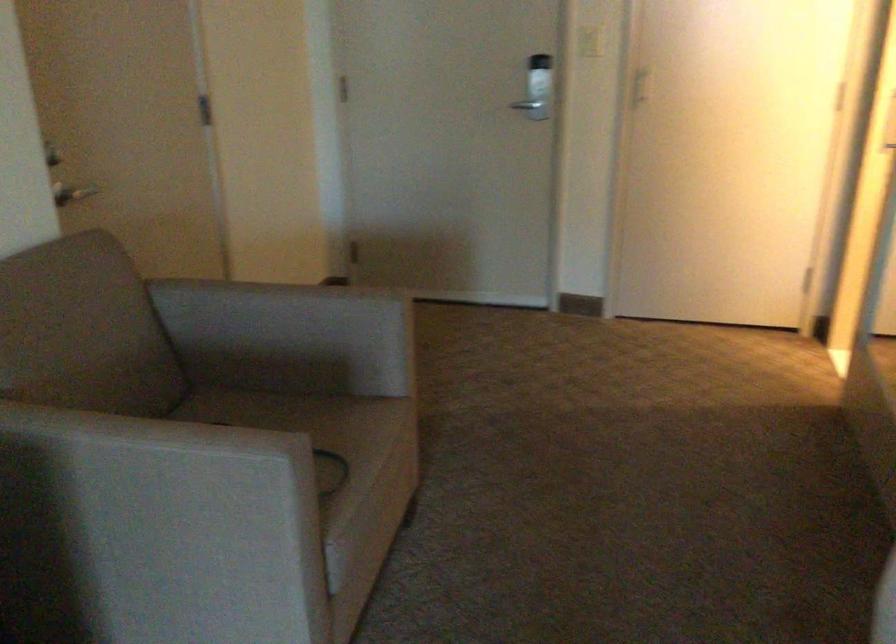
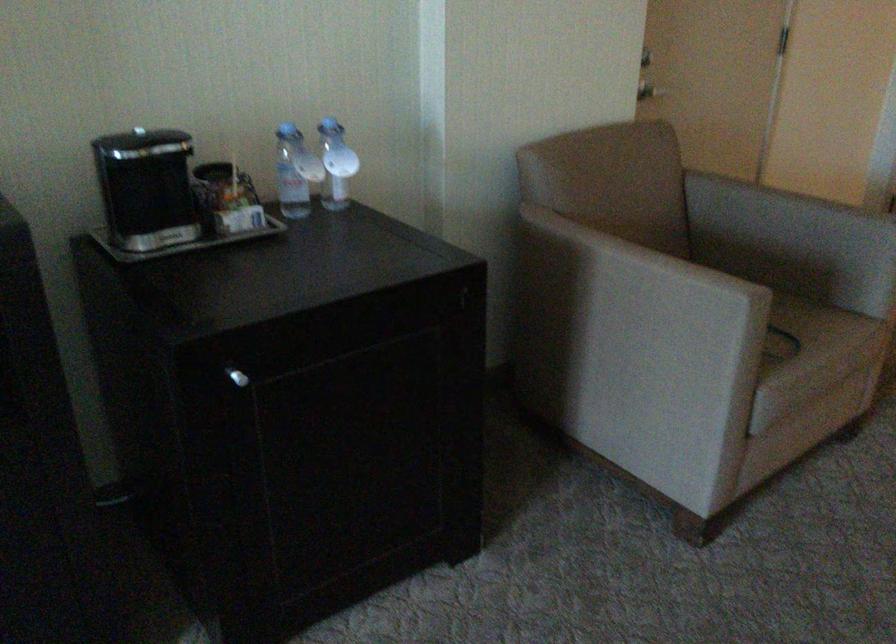
Where in the second image is the point corresponding to point (352, 458) from the first image?

(811, 335)